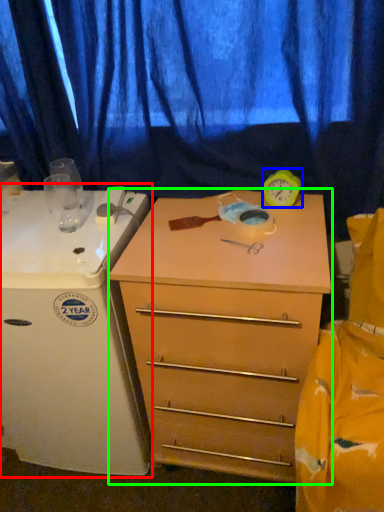
Question: Estimate the real-world distances between objects in this image. Which object is farther from appliance (highlighted by a red box), clock (highlighted by a blue box) or chest of drawers (highlighted by a green box)?

Choices:
 (A) clock
 (B) chest of drawers

Answer: (A)